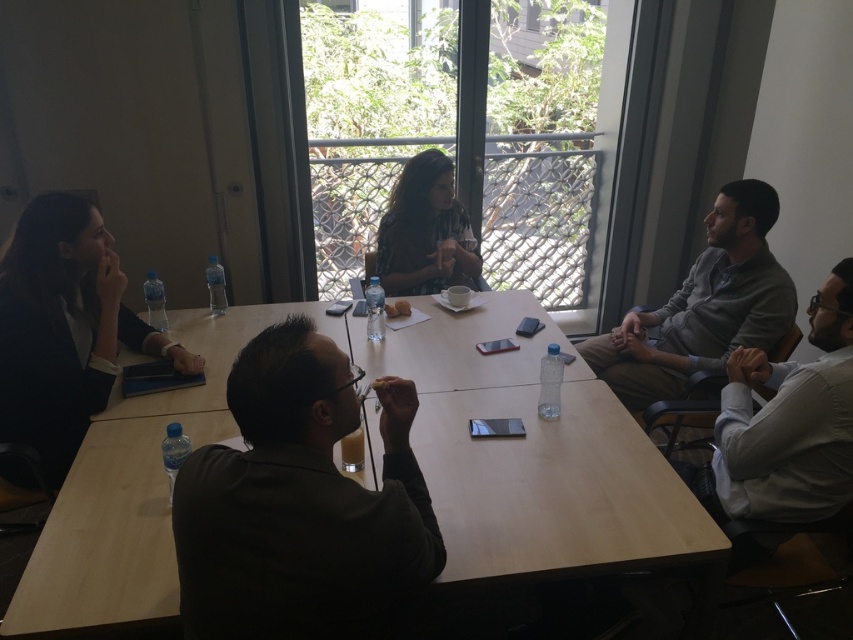
You are a photographer positioned behind the rectangular wooden table in the conference room. You need to capture a photo of both the dark green shirt at center and the matte black shirt at center. Which one will appear larger in the photo?

The dark green shirt at center will appear larger in the photo because it is much taller than the matte black shirt at center.